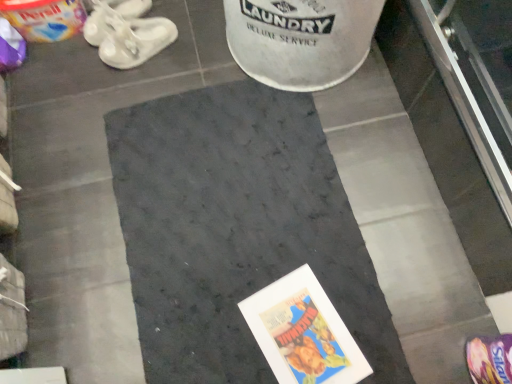
Locate an element on the screen. white rubber sandals at upper left, the 2th footwear in the front-to-back sequence is located at coordinates (135, 40).

At what (x,y) coordinates should I click in order to perform the action: click on dark gray carpet at center. Please return your answer as a coordinate pair (x, y). The height and width of the screenshot is (384, 512). Looking at the image, I should click on (236, 229).

Locate an element on the screen. The height and width of the screenshot is (384, 512). white rubber sandals at upper left, the second footwear in the back-to-front sequence is located at coordinates (135, 40).

Does white rubber sandals at upper left, the 2th footwear in the front-to-back sequence, appear on the left side of white rubber shoes at upper left, the 3th footwear when ordered from front to back?

In fact, white rubber sandals at upper left, the 2th footwear in the front-to-back sequence, is to the right of white rubber shoes at upper left, the 3th footwear when ordered from front to back.

In terms of height, does white rubber sandals at upper left, the 2th footwear in the front-to-back sequence, look taller or shorter compared to white rubber shoes at upper left, which is the 3th footwear in bottom-to-top order?

white rubber sandals at upper left, the 2th footwear in the front-to-back sequence, is taller than white rubber shoes at upper left, which is the 3th footwear in bottom-to-top order.

Is white rubber sandals at upper left, which is counted as the 2th footwear, starting from the left, looking in the opposite direction of white rubber shoes at upper left, the 3th footwear when ordered from front to back?

That's not correct — white rubber sandals at upper left, which is counted as the 2th footwear, starting from the left, is not looking away from white rubber shoes at upper left, the 3th footwear when ordered from front to back.

Who is smaller, white rubber sandals at upper left, which is counted as the 2th footwear, starting from the left, or white rubber shoes at upper left, the first footwear positioned from the top?

white rubber shoes at upper left, the first footwear positioned from the top, is smaller.

Considering the relative sizes of dark gray carpet at center and white rubber shoes at upper left, which is the 3th footwear in bottom-to-top order, in the image provided, is dark gray carpet at center wider than white rubber shoes at upper left, which is the 3th footwear in bottom-to-top order,?

Correct, the width of dark gray carpet at center exceeds that of white rubber shoes at upper left, which is the 3th footwear in bottom-to-top order.

Based on the photo, is dark gray carpet at center closer to camera compared to white rubber shoes at upper left, which is the first footwear in left-to-right order?

Yes, it is in front of white rubber shoes at upper left, which is the first footwear in left-to-right order.

Locate an element on the screen. concrete that appears below the white rubber shoes at upper left, which is the first footwear in left-to-right order (from a real-world perspective) is located at coordinates (236, 229).

Is dark gray carpet at center to the left of white rubber shoes at upper left, which is the 3th footwear in bottom-to-top order, from the viewer's perspective?

In fact, dark gray carpet at center is to the right of white rubber shoes at upper left, which is the 3th footwear in bottom-to-top order.

Who is bigger, white rubber shoes at upper left, the first footwear positioned from the top, or purple fabric footwear at lower right, arranged as the 3th footwear when viewed from the top?

Bigger between the two is white rubber shoes at upper left, the first footwear positioned from the top.

From the image's perspective, is white rubber shoes at upper left, the first footwear positioned from the top, on purple fabric footwear at lower right, arranged as the 3th footwear when viewed from the top?

Yes.

Choose the correct answer: Is white rubber shoes at upper left, the first footwear positioned from the top, inside purple fabric footwear at lower right, the 3th footwear from the left, or outside it?

white rubber shoes at upper left, the first footwear positioned from the top, is not inside purple fabric footwear at lower right, the 3th footwear from the left, it's outside.

Is white rubber shoes at upper left, placed as the 1th footwear when sorted from back to front, closer to the viewer compared to purple fabric footwear at lower right, acting as the first footwear starting from the bottom?

No, white rubber shoes at upper left, placed as the 1th footwear when sorted from back to front, is further to the viewer.

Is dark gray carpet at center further to camera compared to purple fabric footwear at lower right, the 1th footwear in the right-to-left sequence?

Yes, it is.

Is dark gray carpet at center positioned with its back to purple fabric footwear at lower right, the 1th footwear in the right-to-left sequence?

No, dark gray carpet at center's orientation is not away from purple fabric footwear at lower right, the 1th footwear in the right-to-left sequence.

Is point (196, 229) more distant than point (470, 370)?

Yes, it is.

Considering the positions of objects dark gray carpet at center and purple fabric footwear at lower right, the 3th footwear from the left, in the image provided, who is more to the left, dark gray carpet at center or purple fabric footwear at lower right, the 3th footwear from the left,?

From the viewer's perspective, dark gray carpet at center appears more on the left side.

Based on the photo, considering the relative sizes of white rubber sandals at upper left, which is the second footwear from right to left, and purple fabric footwear at lower right, arranged as the 3th footwear when viewed from the top, in the image provided, is white rubber sandals at upper left, which is the second footwear from right to left, taller than purple fabric footwear at lower right, arranged as the 3th footwear when viewed from the top,?

No, white rubber sandals at upper left, which is the second footwear from right to left, is not taller than purple fabric footwear at lower right, arranged as the 3th footwear when viewed from the top.

Does white rubber sandals at upper left, the 2th footwear in the front-to-back sequence, have a smaller size compared to purple fabric footwear at lower right, the 1th footwear positioned from the front?

Actually, white rubber sandals at upper left, the 2th footwear in the front-to-back sequence, might be larger than purple fabric footwear at lower right, the 1th footwear positioned from the front.

Could you measure the distance between white rubber sandals at upper left, the 2th footwear in the front-to-back sequence, and purple fabric footwear at lower right, the 3th footwear from the left?

A distance of 1.26 meters exists between white rubber sandals at upper left, the 2th footwear in the front-to-back sequence, and purple fabric footwear at lower right, the 3th footwear from the left.

How many degrees apart are the facing directions of white rubber sandals at upper left, the 2th footwear when ordered from bottom to top, and purple fabric footwear at lower right, the 1th footwear in the right-to-left sequence?

The angular difference between white rubber sandals at upper left, the 2th footwear when ordered from bottom to top, and purple fabric footwear at lower right, the 1th footwear in the right-to-left sequence, is 41.8 degrees.

Is white rubber shoes at upper left, placed as the 1th footwear when sorted from back to front, aimed at white rubber sandals at upper left, which is the second footwear from right to left?

No, white rubber shoes at upper left, placed as the 1th footwear when sorted from back to front, is not turned towards white rubber sandals at upper left, which is the second footwear from right to left.

Does white rubber shoes at upper left, placed as the 1th footwear when sorted from back to front, have a lesser width compared to white rubber sandals at upper left, which is counted as the 2th footwear, starting from the left?

Incorrect, the width of white rubber shoes at upper left, placed as the 1th footwear when sorted from back to front, is not less than that of white rubber sandals at upper left, which is counted as the 2th footwear, starting from the left.

Does point (95, 17) appear closer or farther from the camera than point (134, 54)?

Point (95, 17) is farther from the camera than point (134, 54).

Between purple fabric footwear at lower right, which ranks as the third footwear in back-to-front order, and dark gray carpet at center, which one has more height?

purple fabric footwear at lower right, which ranks as the third footwear in back-to-front order.

What's the angular difference between purple fabric footwear at lower right, the 3th footwear from the left, and dark gray carpet at center's facing directions?

purple fabric footwear at lower right, the 3th footwear from the left, and dark gray carpet at center are facing 104 degrees away from each other.

From a real-world perspective, who is located higher, purple fabric footwear at lower right, the 3th footwear from the left, or dark gray carpet at center?

purple fabric footwear at lower right, the 3th footwear from the left, is physically above.

Identify the location of concrete located on the left of purple fabric footwear at lower right, arranged as the 3th footwear when viewed from the top. (236, 229).

Find the location of a particular element. the 1st footwear located above the white rubber shoes at upper left, placed as the 1th footwear when sorted from back to front (from a real-world perspective) is located at coordinates (135, 40).

This screenshot has width=512, height=384. In order to click on concrete on the right of white rubber shoes at upper left, the first footwear positioned from the top in this screenshot , I will do `click(236, 229)`.

Based on their spatial positions, is white rubber shoes at upper left, which is the 3th footwear in bottom-to-top order, or purple fabric footwear at lower right, the 3th footwear from the left, further from dark gray carpet at center?

white rubber shoes at upper left, which is the 3th footwear in bottom-to-top order, is further to dark gray carpet at center.

Which object lies nearer to the anchor point white rubber sandals at upper left, the 2th footwear when ordered from bottom to top, white rubber shoes at upper left, which is the 3th footwear from right to left, or dark gray carpet at center?

white rubber shoes at upper left, which is the 3th footwear from right to left, lies closer to white rubber sandals at upper left, the 2th footwear when ordered from bottom to top, than the other object.

From the image, which object appears to be farther from white rubber shoes at upper left, which is the 3th footwear from right to left, purple fabric footwear at lower right, the 1th footwear in the right-to-left sequence, or white rubber sandals at upper left, the 2th footwear in the front-to-back sequence?

The object further to white rubber shoes at upper left, which is the 3th footwear from right to left, is purple fabric footwear at lower right, the 1th footwear in the right-to-left sequence.

Which object lies nearer to the anchor point purple fabric footwear at lower right, acting as the first footwear starting from the bottom, white rubber sandals at upper left, the 2th footwear in the front-to-back sequence, or dark gray carpet at center?

dark gray carpet at center is positioned closer to the anchor purple fabric footwear at lower right, acting as the first footwear starting from the bottom.

When comparing their distances from purple fabric footwear at lower right, the 1th footwear in the right-to-left sequence, does white rubber sandals at upper left, the second footwear in the back-to-front sequence, or white rubber shoes at upper left, which is the 3th footwear from right to left, seem further?

white rubber shoes at upper left, which is the 3th footwear from right to left, lies further to purple fabric footwear at lower right, the 1th footwear in the right-to-left sequence, than the other object.

From the image, which object appears to be farther from white rubber shoes at upper left, which is the 3th footwear in bottom-to-top order, dark gray carpet at center or white rubber sandals at upper left, the 2th footwear in the front-to-back sequence?

dark gray carpet at center is further to white rubber shoes at upper left, which is the 3th footwear in bottom-to-top order.

When comparing their distances from white rubber shoes at upper left, which is the first footwear in left-to-right order, does white rubber sandals at upper left, the 2th footwear in the front-to-back sequence, or dark gray carpet at center seem further?

dark gray carpet at center is further to white rubber shoes at upper left, which is the first footwear in left-to-right order.

Based on their spatial positions, is dark gray carpet at center or purple fabric footwear at lower right, acting as the first footwear starting from the bottom, further from white rubber shoes at upper left, which is the 3th footwear from right to left?

purple fabric footwear at lower right, acting as the first footwear starting from the bottom, lies further to white rubber shoes at upper left, which is the 3th footwear from right to left, than the other object.

Locate an element on the screen. The image size is (512, 384). concrete located between white rubber sandals at upper left, which is the second footwear from right to left, and purple fabric footwear at lower right, the 3th footwear from the left, in the left-right direction is located at coordinates (236, 229).

Locate an element on the screen. The image size is (512, 384). concrete between white rubber shoes at upper left, placed as the 1th footwear when sorted from back to front, and purple fabric footwear at lower right, arranged as the 3th footwear when viewed from the top is located at coordinates (236, 229).

Where is `footwear between white rubber shoes at upper left, the first footwear positioned from the top, and dark gray carpet at center vertically`? The image size is (512, 384). footwear between white rubber shoes at upper left, the first footwear positioned from the top, and dark gray carpet at center vertically is located at coordinates (135, 40).

Locate an element on the screen. The width and height of the screenshot is (512, 384). footwear between white rubber shoes at upper left, placed as the 1th footwear when sorted from back to front, and purple fabric footwear at lower right, which ranks as the third footwear in back-to-front order is located at coordinates (135, 40).